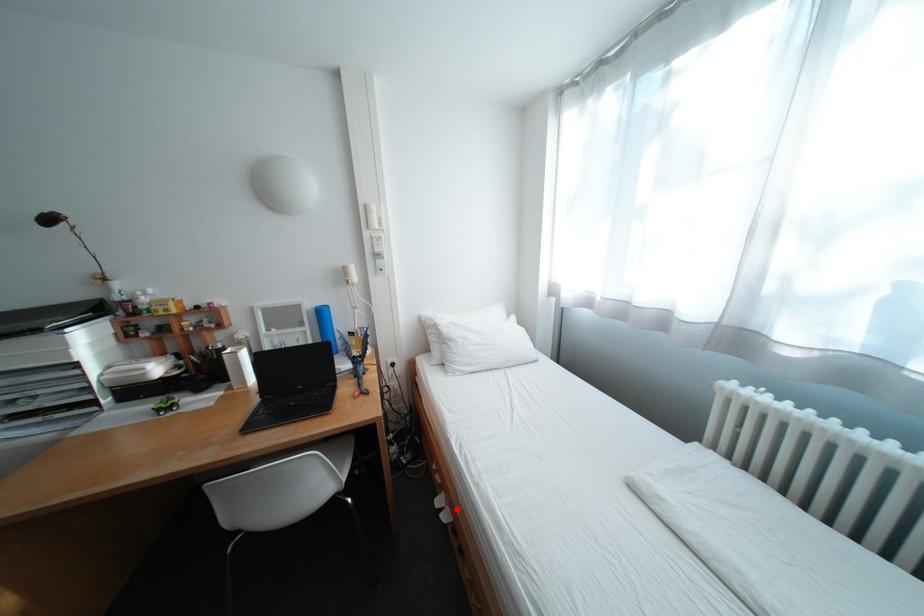
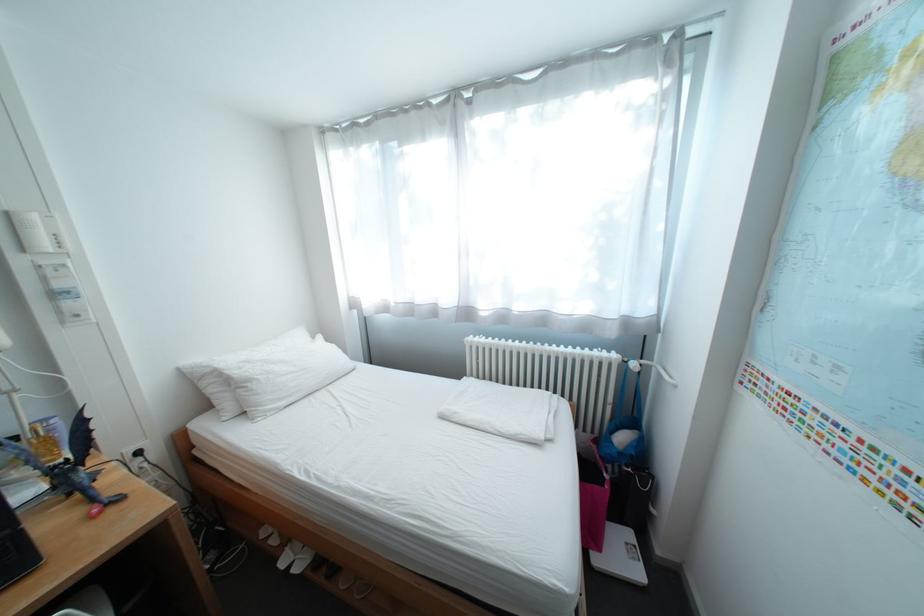
Question: I am providing you with two images of the same scene from different viewpoints. In image1, a red point is highlighted. Considering the same 3D point in image2, which of the following is correct?

Choices:
 (A) It is closer
 (B) It is farther

Answer: (A)